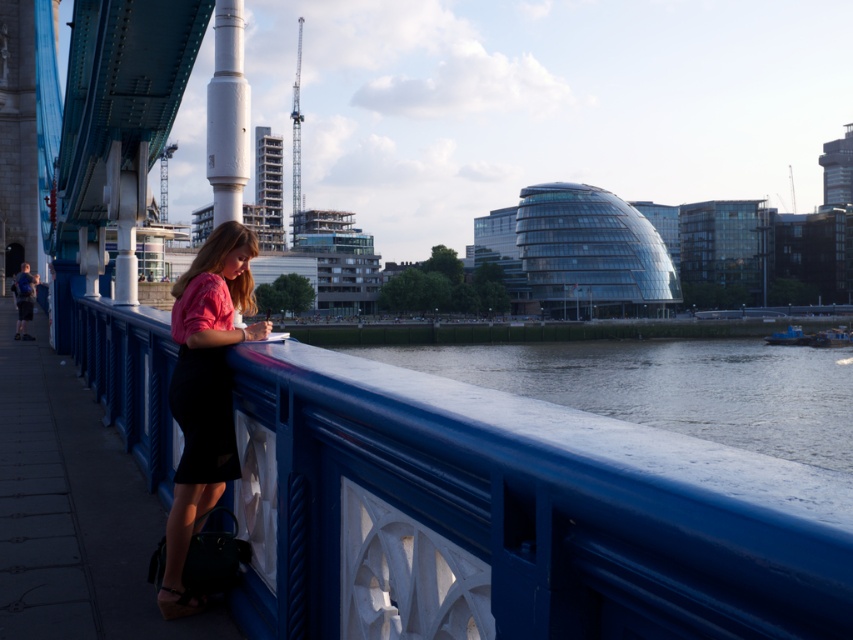
Question: Which object is the closest to the blue smooth water at lower center?

Choices:
 (A) blue painted wood at center
 (B) matte pink blouse at center

Answer: (B)

Question: Which object is positioned farthest from the blue painted wood at center?

Choices:
 (A) matte pink blouse at center
 (B) blue smooth water at lower center

Answer: (B)

Question: Is blue painted wood at center above matte pink blouse at center?

Choices:
 (A) no
 (B) yes

Answer: (B)

Question: Does blue smooth water at lower center come in front of matte pink blouse at center?

Choices:
 (A) no
 (B) yes

Answer: (A)

Question: Among these objects, which one is nearest to the camera?

Choices:
 (A) matte pink blouse at center
 (B) blue painted wood at center
 (C) blue smooth water at lower center

Answer: (B)

Question: Does blue smooth water at lower center come in front of matte pink blouse at center?

Choices:
 (A) no
 (B) yes

Answer: (A)